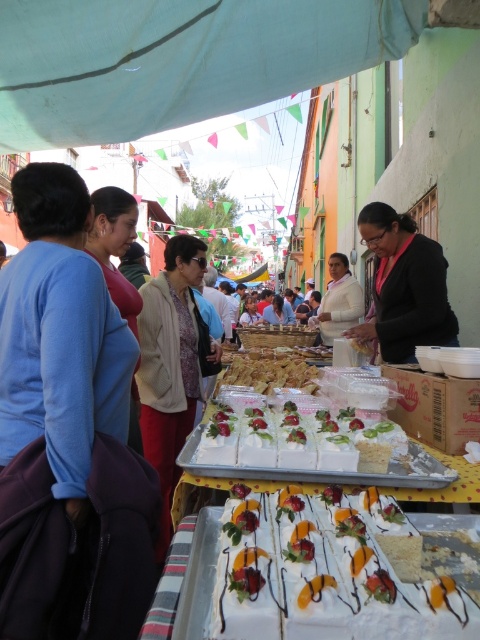
Who is shorter, blue fabric bag at left or white frosted cake at center?

white frosted cake at center

Is point (142, 609) positioned after point (465, 609)?

Yes.

The image size is (480, 640). What are the coordinates of `blue fabric bag at left` in the screenshot? It's located at 68,433.

Which is more to the right, blue fabric bag at left or golden crispy pastry at center?

golden crispy pastry at center is more to the right.

Is blue fabric bag at left thinner than golden crispy pastry at center?

Yes.

Identify the location of blue fabric bag at left. (68, 433).

Measure the distance between point (7, 397) and camera.

Point (7, 397) is 5.18 feet from camera.

Is blue fabric bag at left smaller than pink fabric at center?

Indeed, blue fabric bag at left has a smaller size compared to pink fabric at center.

Looking at this image, who is more forward, (x=62, y=627) or (x=428, y=291)?

Positioned in front is point (x=62, y=627).

You are a GUI agent. You are given a task and a screenshot of the screen. Output one action in this format:
    pyautogui.click(x=<x>, y=<y>)
    Task: Click on the blue fabric bag at left
    
    Given the screenshot: What is the action you would take?
    pyautogui.click(x=68, y=433)